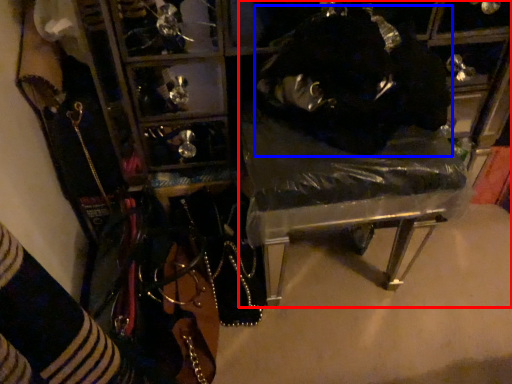
Question: Which object appears closest to the camera in this image, furniture (highlighted by a red box) or person (highlighted by a blue box)?

Choices:
 (A) furniture
 (B) person

Answer: (B)